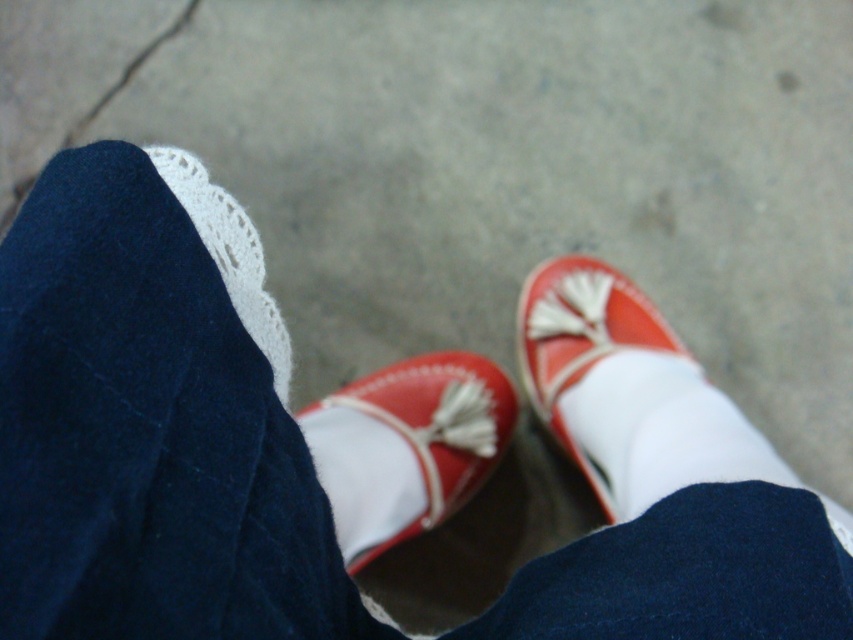
Between red leather shoe at center and white lace at upper left, which one has less height?

With less height is white lace at upper left.

Between point (505, 419) and point (260, 326), which one is positioned behind?

The point (505, 419) is behind.

The height and width of the screenshot is (640, 853). What are the coordinates of `red leather shoe at center` in the screenshot? It's located at (409, 445).

The width and height of the screenshot is (853, 640). In order to click on red leather shoe at center in this screenshot , I will do `click(409, 445)`.

Is red leather shoe at center to the right of matte leather shoe at lower right from the viewer's perspective?

Incorrect, red leather shoe at center is not on the right side of matte leather shoe at lower right.

Which is in front, point (383, 544) or point (645, 305)?

Point (383, 544) is more forward.

Locate an element on the screen. red leather shoe at center is located at coordinates (409, 445).

Is matte leather shoe at lower right positioned at the back of white lace at upper left?

Yes, matte leather shoe at lower right is behind white lace at upper left.

Does point (544, 284) come farther from viewer compared to point (225, 196)?

Yes, point (544, 284) is behind point (225, 196).

Measure the distance between matte leather shoe at lower right and camera.

matte leather shoe at lower right is 3.85 feet away from camera.

Identify the location of matte leather shoe at lower right. The height and width of the screenshot is (640, 853). (581, 344).